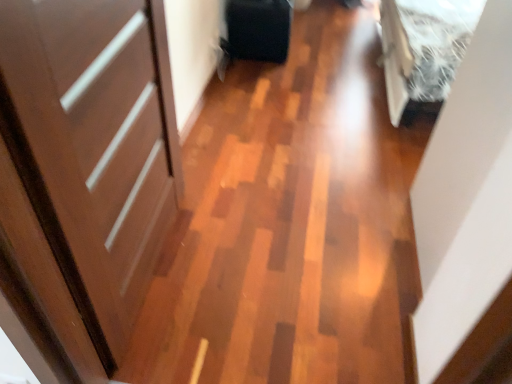
Question: Visually, is matte black suitcase at center positioned to the left or to the right of matte brown door at left?

Choices:
 (A) left
 (B) right

Answer: (B)

Question: Is point (271, 21) positioned closer to the camera than point (66, 96)?

Choices:
 (A) closer
 (B) farther

Answer: (B)

Question: Which object is positioned farthest from the matte black suitcase at center?

Choices:
 (A) white fluffy bed at upper right
 (B) matte brown door at left

Answer: (B)

Question: Estimate the real-world distances between objects in this image. Which object is closer to the matte brown door at left?

Choices:
 (A) white fluffy bed at upper right
 (B) matte black suitcase at center

Answer: (A)